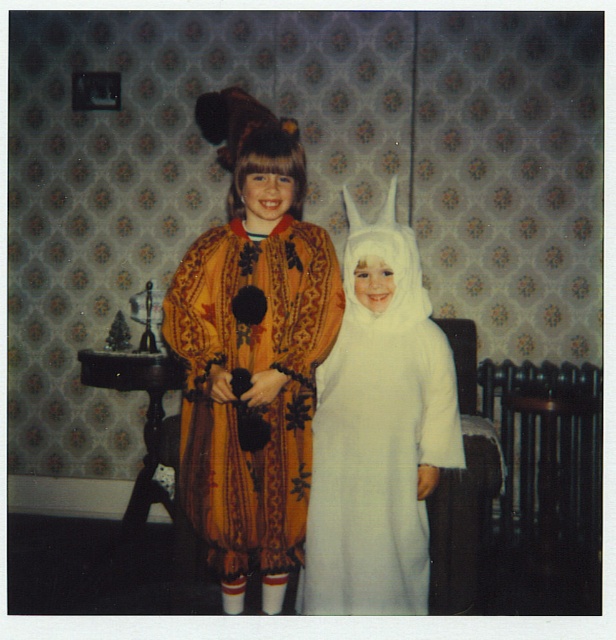
Which is more to the right, white fluffy costume at center or golden velvet robe at center?

white fluffy costume at center

Does white fluffy costume at center appear on the left side of golden velvet robe at center?

Incorrect, white fluffy costume at center is not on the left side of golden velvet robe at center.

Describe the element at coordinates (378, 432) in the screenshot. The image size is (616, 640). I see `white fluffy costume at center` at that location.

Where is `white fluffy costume at center`? The image size is (616, 640). white fluffy costume at center is located at coordinates (378, 432).

Can you confirm if velvet orange robe at center is positioned to the right of golden velvet robe at center?

Correct, you'll find velvet orange robe at center to the right of golden velvet robe at center.

Describe the element at coordinates (251, 349) in the screenshot. The height and width of the screenshot is (640, 616). I see `velvet orange robe at center` at that location.

Image resolution: width=616 pixels, height=640 pixels. Find the location of `velvet orange robe at center`. velvet orange robe at center is located at coordinates (251, 349).

Does velvet orange robe at center appear under white fluffy costume at center?

No.

Is velvet orange robe at center behind white fluffy costume at center?

That is False.

Is point (237, 179) positioned behind point (359, 273)?

No, (237, 179) is closer to viewer.

Locate an element on the screen. The height and width of the screenshot is (640, 616). velvet orange robe at center is located at coordinates (251, 349).